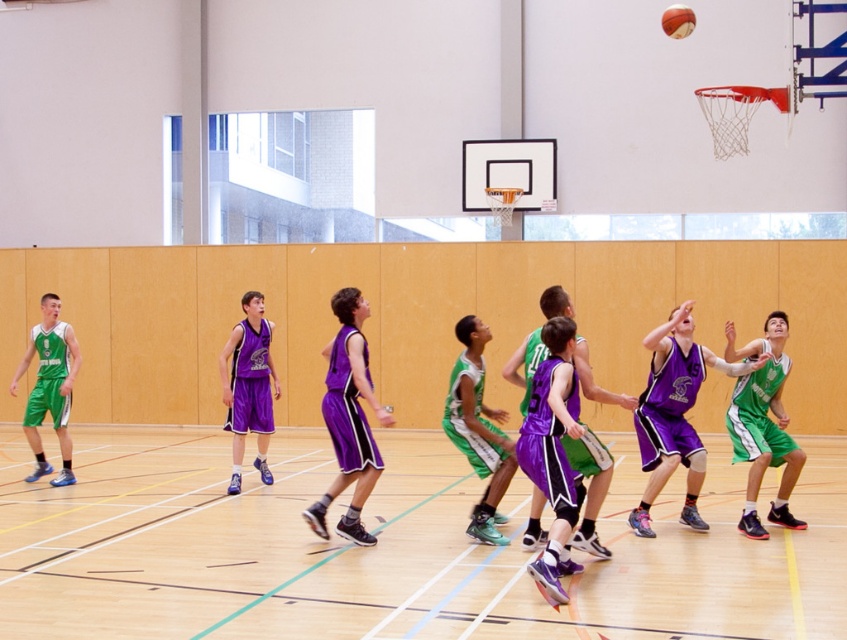
From the picture: Can you confirm if wooden floor at center is shorter than purple matte basketball player at center?

Yes, wooden floor at center is shorter than purple matte basketball player at center.

Does point (435, 570) come behind point (352, 476)?

No, it is in front of (352, 476).

Is point (638, 561) positioned before point (346, 516)?

Yes, point (638, 561) is closer to viewer.

The height and width of the screenshot is (640, 847). What are the coordinates of `wooden floor at center` in the screenshot? It's located at (389, 548).

Does purple shiny jersey at center have a greater height compared to green matte basketball player at center?

Incorrect, purple shiny jersey at center's height is not larger of green matte basketball player at center's.

Is point (591, 476) positioned after point (490, 486)?

Yes, it is.

Locate an element on the screen. The image size is (847, 640). purple shiny jersey at center is located at coordinates (590, 486).

Between point (530, 364) and point (65, 449), which one is positioned behind?

Point (65, 449)

Identify the location of purple shiny jersey at center. (590, 486).

Does point (596, 488) come in front of point (64, 435)?

Yes, it is.

Locate an element on the screen. The height and width of the screenshot is (640, 847). purple shiny jersey at center is located at coordinates (590, 486).